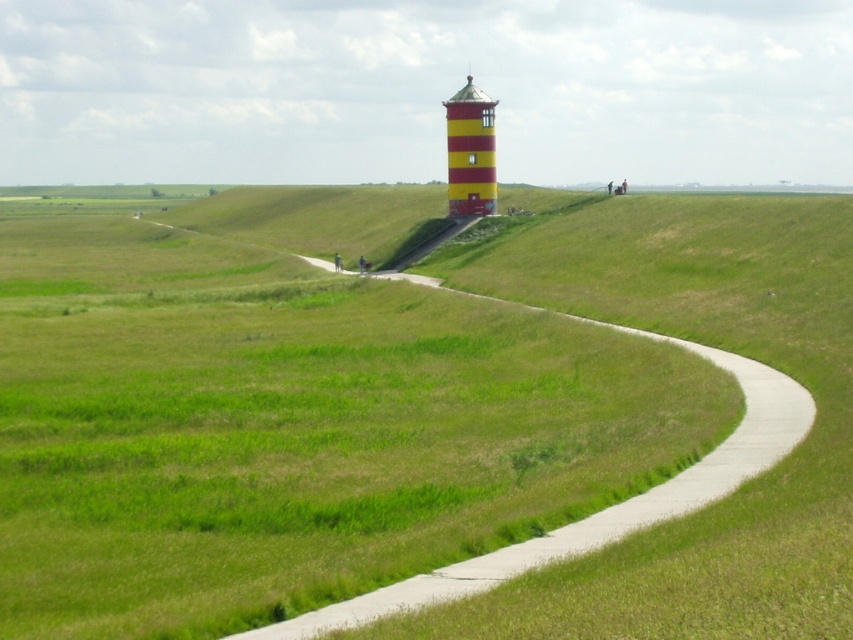
Question: Which of the following is the farthest from the observer?

Choices:
 (A) pyautogui.click(x=480, y=106)
 (B) pyautogui.click(x=566, y=376)

Answer: (A)

Question: Can you confirm if green grass at upper center is positioned above yellow striped tower at center?

Choices:
 (A) yes
 (B) no

Answer: (B)

Question: Which point is closer to the camera?

Choices:
 (A) (693, 397)
 (B) (489, 180)

Answer: (A)

Question: Is green grass at upper center thinner than yellow striped tower at center?

Choices:
 (A) yes
 (B) no

Answer: (B)

Question: Which of the following is the closest to the observer?

Choices:
 (A) pyautogui.click(x=126, y=332)
 (B) pyautogui.click(x=476, y=138)

Answer: (A)

Question: Does green grass at upper center have a greater width compared to yellow striped tower at center?

Choices:
 (A) yes
 (B) no

Answer: (A)